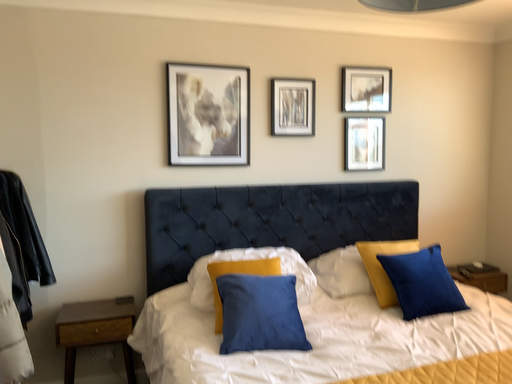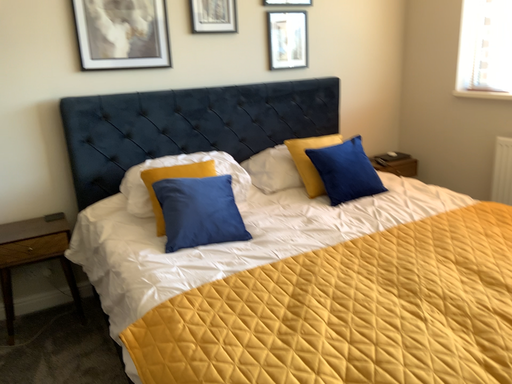
Question: Which way did the camera rotate in the video?

Choices:
 (A) rotated downward
 (B) rotated upward

Answer: (A)